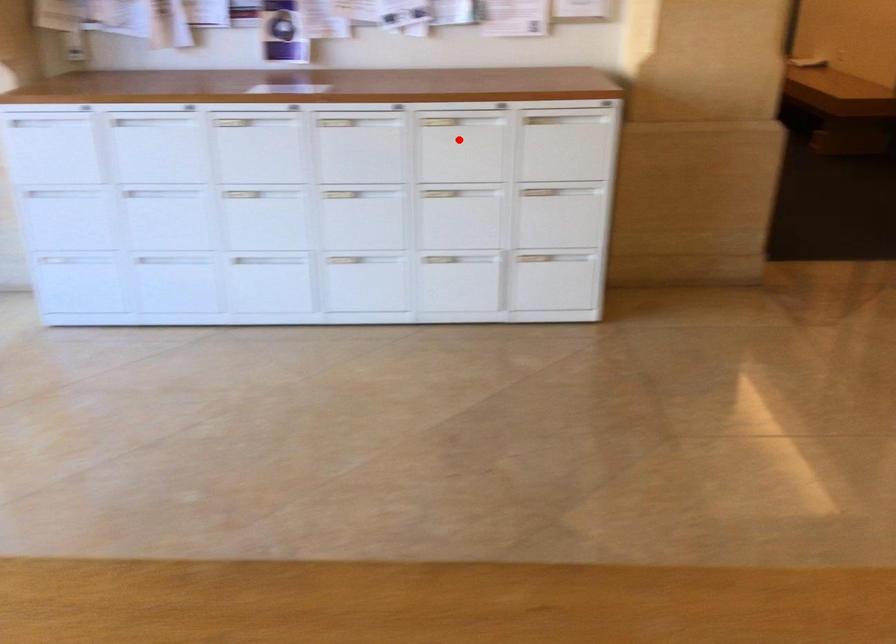
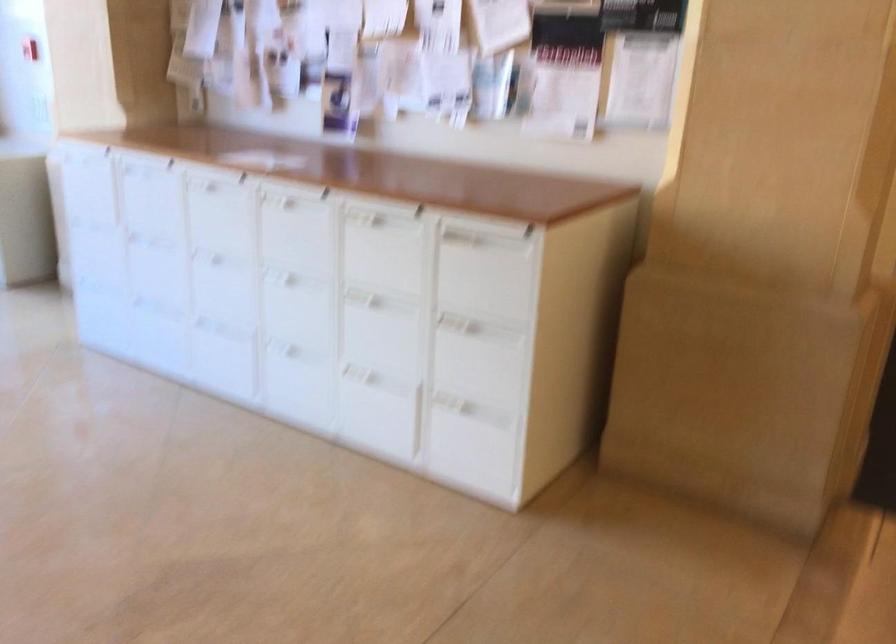
Question: I am providing you with two images of the same scene from different viewpoints. In image1, a red point is highlighted. Considering the same 3D point in image2, which of the following is correct?

Choices:
 (A) It is closer
 (B) It is farther

Answer: (A)